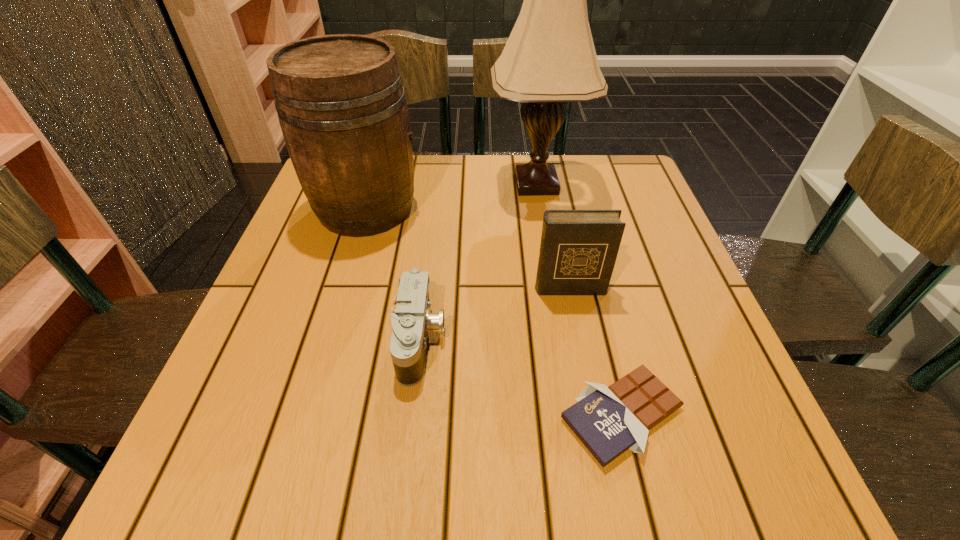
Identify the location of unoccupied area between the camera and the third shortest object. (495, 314).

Image resolution: width=960 pixels, height=540 pixels. I want to click on vacant space in between the tallest object and the cider, so click(x=451, y=196).

You are a GUI agent. You are given a task and a screenshot of the screen. Output one action in this format:
    pyautogui.click(x=<x>, y=<y>)
    Task: Click on the free space between the chocolate bar and the third tallest object
    This screenshot has height=540, width=960.
    Given the screenshot: What is the action you would take?
    pyautogui.click(x=595, y=352)

The height and width of the screenshot is (540, 960). I want to click on free space between the diary and the cider, so click(x=468, y=248).

I want to click on object that is the second closest one to the tallest object, so click(578, 250).

Locate an element on the screen. This screenshot has height=540, width=960. the second closest object to the chocolate bar is located at coordinates (411, 319).

Where is `vacant area in the image that satisfies the following two spatial constraints: 1. on the back side of the chocolate bar; 2. on the lens of the fourth tallest object`? This screenshot has height=540, width=960. vacant area in the image that satisfies the following two spatial constraints: 1. on the back side of the chocolate bar; 2. on the lens of the fourth tallest object is located at coordinates (603, 340).

Find the location of `vacant space that satisfies the following two spatial constraints: 1. on the side of the shortest object near the bung hole; 2. on the left side of the second tallest object`. vacant space that satisfies the following two spatial constraints: 1. on the side of the shortest object near the bung hole; 2. on the left side of the second tallest object is located at coordinates click(303, 415).

You are a GUI agent. You are given a task and a screenshot of the screen. Output one action in this format:
    pyautogui.click(x=<x>, y=<y>)
    Task: Click on the vacant region that satisfies the following two spatial constraints: 1. on the front cover of the diary; 2. on the right side of the chocolate bar
    Image resolution: width=960 pixels, height=540 pixels.
    Given the screenshot: What is the action you would take?
    pyautogui.click(x=594, y=415)

You are a GUI agent. You are given a task and a screenshot of the screen. Output one action in this format:
    pyautogui.click(x=<x>, y=<y>)
    Task: Click on the free space that satisfies the following two spatial constraints: 1. on the side of the shortest object near the bung hole; 2. on the right side of the second tallest object
    The image size is (960, 540).
    Given the screenshot: What is the action you would take?
    pyautogui.click(x=303, y=415)